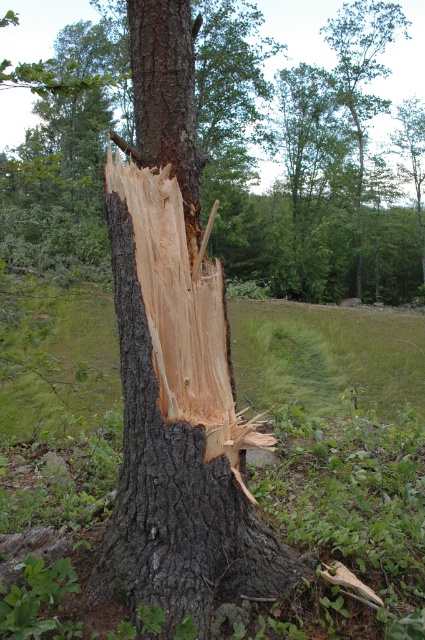
Looking at the tree trunk in the scene, which part is taller between the smooth brown bark at center and the dark brown rough bark at center?

The smooth brown bark at center is much taller than the dark brown rough bark at center.